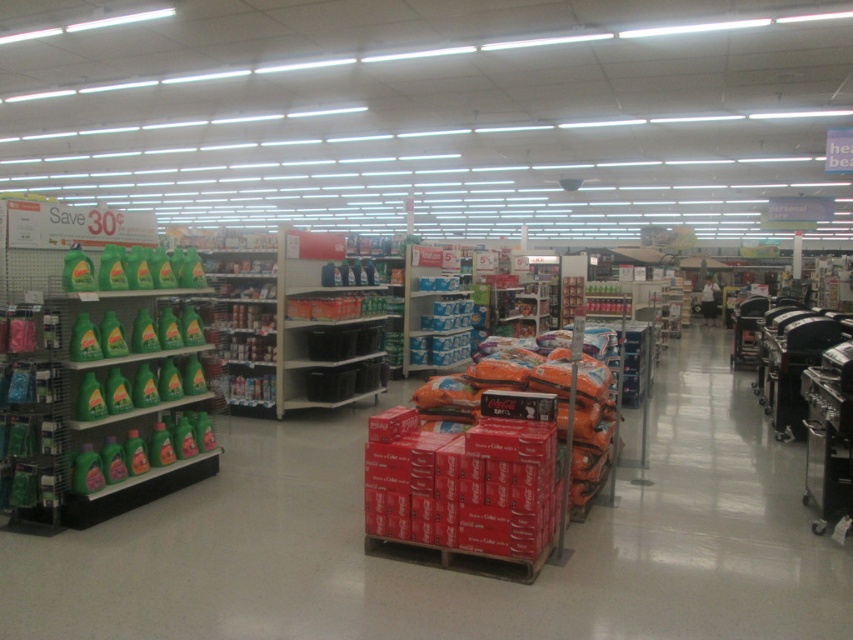
You are standing at the entrance of the store and see the point marked at coordinates (329, 323). According to the store layout, where is this point located?

The point marked at coordinates (329, 323) is located on the black plastic shelves at center.